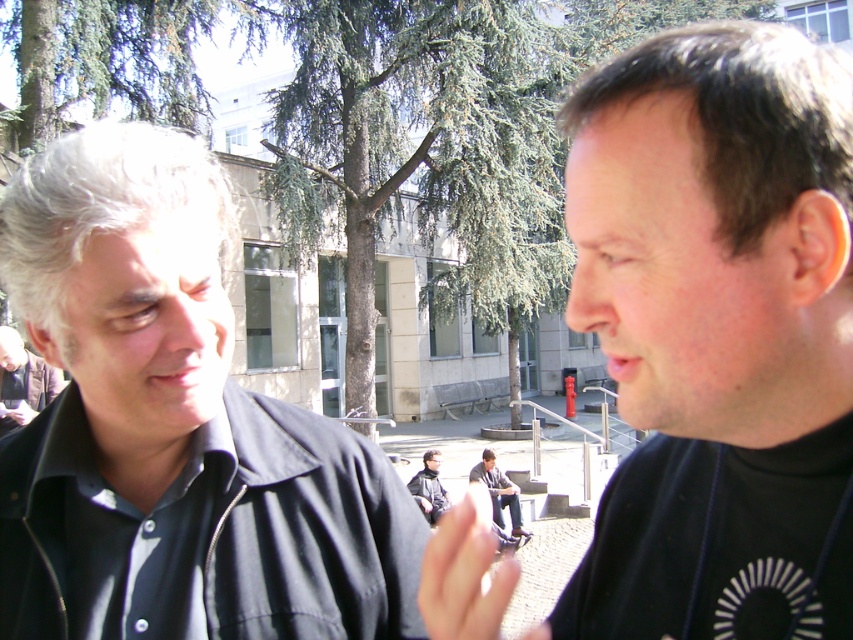
Question: Which point is farther to the camera?

Choices:
 (A) (189, 220)
 (B) (521, 524)
 (C) (15, 371)

Answer: (B)

Question: Does black matte shirt at left appear on the right side of light brown leather jacket at left?

Choices:
 (A) no
 (B) yes

Answer: (B)

Question: Which point appears closest to the camera in this image?

Choices:
 (A) (614, 189)
 (B) (410, 624)
 (C) (0, 432)
 (D) (490, 492)

Answer: (A)

Question: In this image, where is black matte shirt at right located relative to black matte shirt at left?

Choices:
 (A) right
 (B) left

Answer: (A)

Question: Which point is farther to the camera?

Choices:
 (A) (517, 499)
 (B) (254, 614)
 (C) (38, 385)
 (D) (653, 260)

Answer: (A)

Question: Can you confirm if black matte shirt at left is positioned above dark gray jeans at center?

Choices:
 (A) no
 (B) yes

Answer: (B)